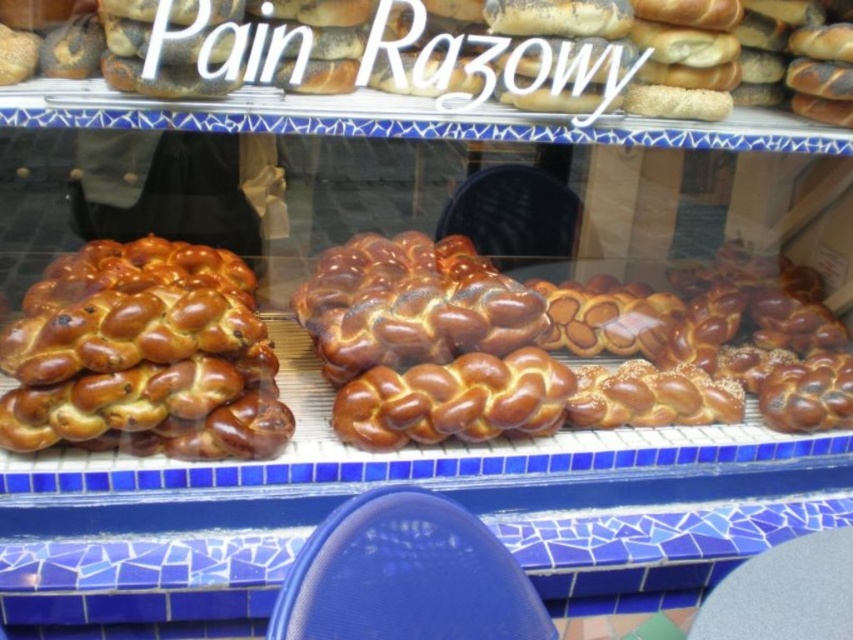
Question: Which of the following is the farthest from the observer?

Choices:
 (A) golden brown braided loaf at center
 (B) golden-brown braided bread at left

Answer: (B)

Question: Is golden brown braided loaf at center behind golden-brown braided bread at left?

Choices:
 (A) yes
 (B) no

Answer: (B)

Question: Which object is farther from the camera taking this photo?

Choices:
 (A) golden-brown braided bread at left
 (B) golden brown braided loaf at center

Answer: (A)

Question: Considering the relative positions of golden brown braided loaf at center and golden-brown braided bread at left in the image provided, where is golden brown braided loaf at center located with respect to golden-brown braided bread at left?

Choices:
 (A) below
 (B) above

Answer: (B)

Question: Can you confirm if golden brown braided loaf at center is smaller than golden-brown braided bread at left?

Choices:
 (A) yes
 (B) no

Answer: (B)